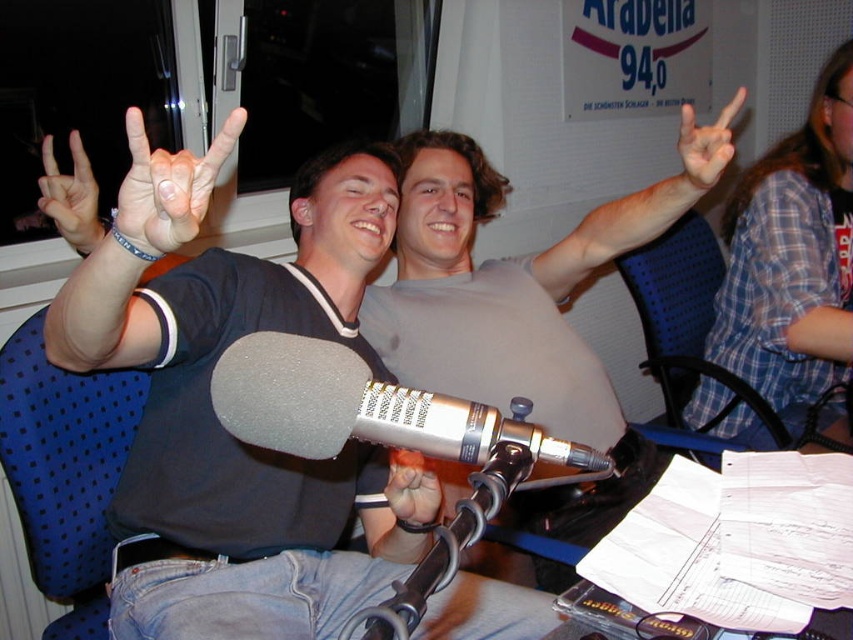
Question: Which point is farther from the camera taking this photo?

Choices:
 (A) (166, 236)
 (B) (450, 214)

Answer: (B)

Question: Which object is the closest to the matte black hand at upper left?

Choices:
 (A) silver/metallic microphone at center
 (B) smooth skin hand at center
 (C) white matte hand at upper right

Answer: (A)

Question: Can you confirm if silver/metallic microphone at center is bigger than smooth skin hand at center?

Choices:
 (A) yes
 (B) no

Answer: (A)

Question: Does white matte hand at upper right come in front of smooth skin hand at center?

Choices:
 (A) no
 (B) yes

Answer: (A)

Question: From the image, what is the correct spatial relationship of matte black hand at upper left in relation to white matte hand at upper left?

Choices:
 (A) below
 (B) above

Answer: (A)

Question: Among these points, which one is nearest to the camera?

Choices:
 (A) (91, 220)
 (B) (700, 193)

Answer: (A)